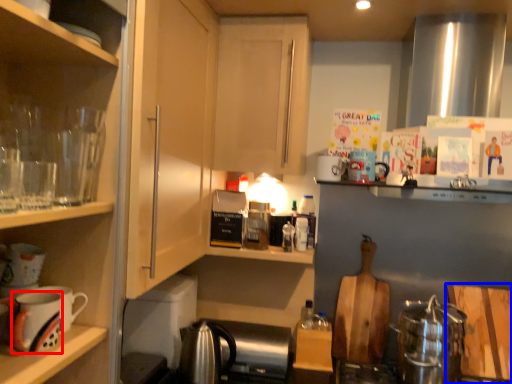
Question: Which of the following is the closest to the observer, mug (highlighted by a red box) or cutting board (highlighted by a blue box)?

Choices:
 (A) mug
 (B) cutting board

Answer: (A)